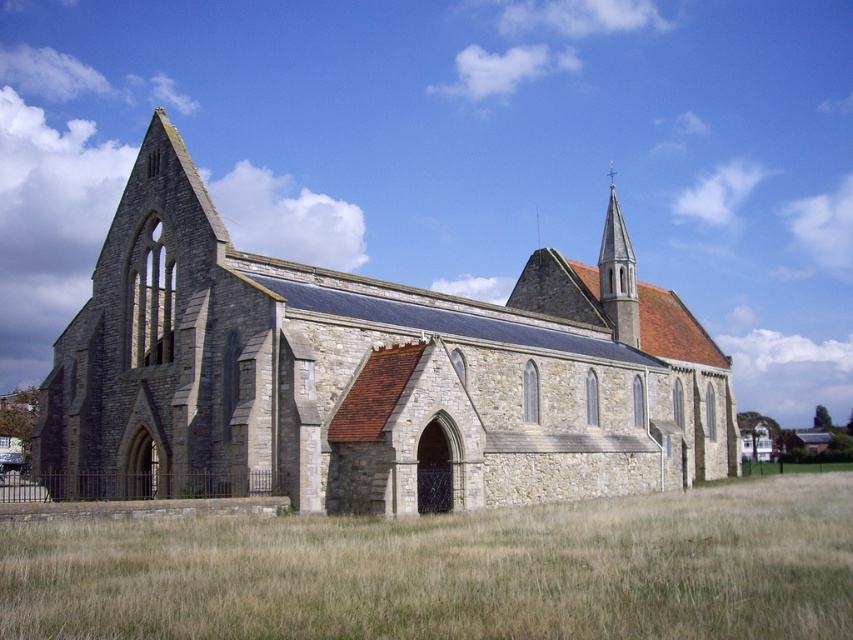
At what (x,y) coordinates should I click in order to perform the action: click on gray stone church at center. Please return your answer as a coordinate pair (x, y). The image size is (853, 640). Looking at the image, I should click on (360, 376).

Based on the photo, which is more to the left, gray stone church at center or brown dry grass at lower center?

Positioned to the left is gray stone church at center.

The image size is (853, 640). Describe the element at coordinates (360, 376) in the screenshot. I see `gray stone church at center` at that location.

Where is `gray stone church at center`? gray stone church at center is located at coordinates (360, 376).

Between gray stone church at center and smooth gold spire at upper center, which one is positioned higher?

Positioned higher is smooth gold spire at upper center.

Which is behind, point (142, 353) or point (601, 248)?

Point (601, 248)

You are a GUI agent. You are given a task and a screenshot of the screen. Output one action in this format:
    pyautogui.click(x=<x>, y=<y>)
    Task: Click on the gray stone church at center
    The image size is (853, 640).
    Given the screenshot: What is the action you would take?
    pyautogui.click(x=360, y=376)

I want to click on gray stone church at center, so click(x=360, y=376).

Looking at this image, which is more to the left, brown dry grass at lower center or smooth gold spire at upper center?

Positioned to the left is brown dry grass at lower center.

Looking at this image, which is more to the right, brown dry grass at lower center or smooth gold spire at upper center?

smooth gold spire at upper center

Identify the location of brown dry grass at lower center. This screenshot has height=640, width=853. (453, 570).